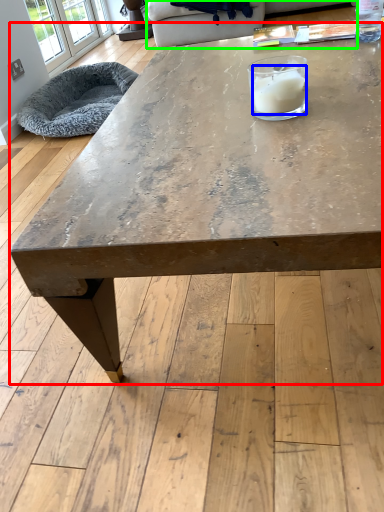
Question: Based on their relative distances, which object is farther from coffee table (highlighted by a red box)? Choose from candle (highlighted by a blue box) and couch (highlighted by a green box).

Choices:
 (A) candle
 (B) couch

Answer: (B)